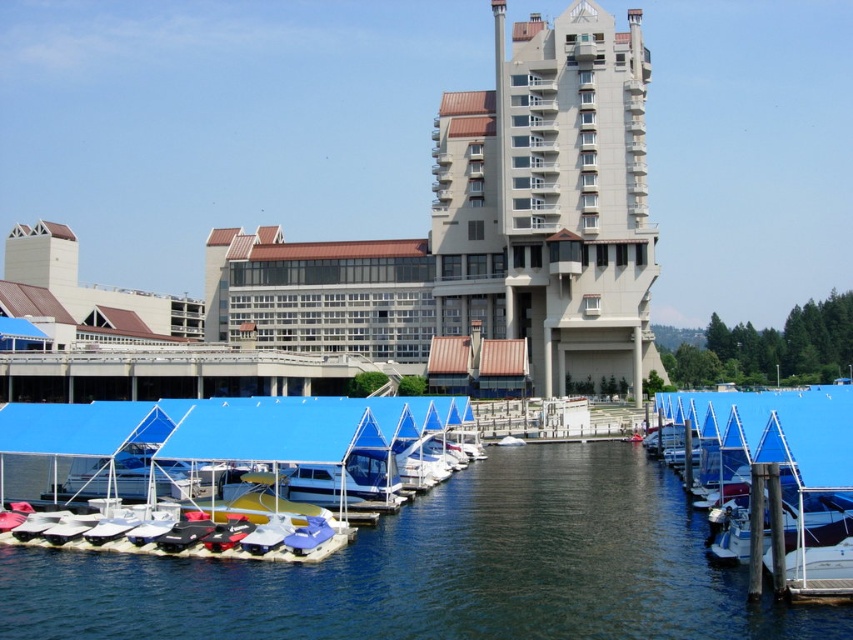
Question: Can you confirm if blue water at center is smaller than blue tarp-covered boats at center?

Choices:
 (A) yes
 (B) no

Answer: (A)

Question: Among these points, which one is nearest to the camera?

Choices:
 (A) (634, 269)
 (B) (96, 612)
 (C) (33, 512)

Answer: (B)

Question: Which point is closer to the camera taking this photo?

Choices:
 (A) (791, 449)
 (B) (611, 56)
 (C) (560, 493)

Answer: (A)

Question: Is the position of blue water at center less distant than that of blue tarpaulin boat at center?

Choices:
 (A) yes
 (B) no

Answer: (A)

Question: Does blue tarp-covered boats at center have a lesser width compared to blue tarpaulin boat at center?

Choices:
 (A) yes
 (B) no

Answer: (B)

Question: Which point is closer to the camera taking this photo?

Choices:
 (A) (747, 408)
 (B) (540, 392)
 (C) (202, 490)

Answer: (A)